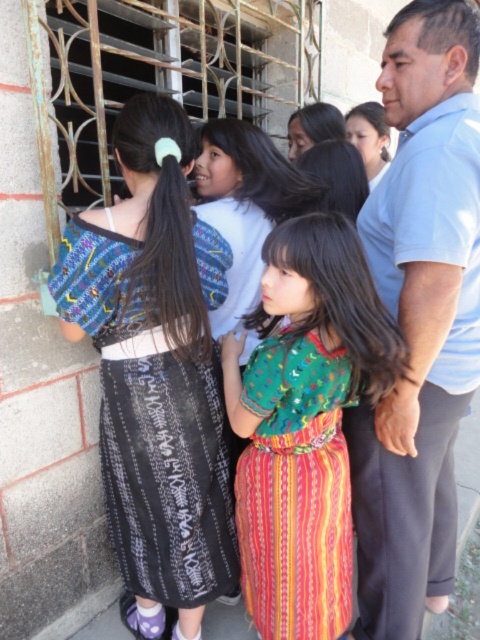
Question: Among these objects, which one is farthest from the camera?

Choices:
 (A) multicolored woven dress at center
 (B) light blue shirt at center
 (C) matte green blouse at upper center

Answer: (C)

Question: Can you confirm if light blue shirt at center is bigger than black woven skirt at left?

Choices:
 (A) no
 (B) yes

Answer: (B)

Question: Can you confirm if light blue shirt at center is bigger than matte green blouse at upper center?

Choices:
 (A) yes
 (B) no

Answer: (A)

Question: Does black woven skirt at left appear under matte green blouse at upper center?

Choices:
 (A) yes
 (B) no

Answer: (A)

Question: Among these points, which one is nearest to the camera?

Choices:
 (A) (307, 422)
 (B) (377, 161)
 (C) (393, 337)
 (D) (425, 476)

Answer: (C)

Question: Which object is the farthest from the green woven dress at center?

Choices:
 (A) multicolored woven dress at center
 (B) matte green blouse at upper center

Answer: (B)